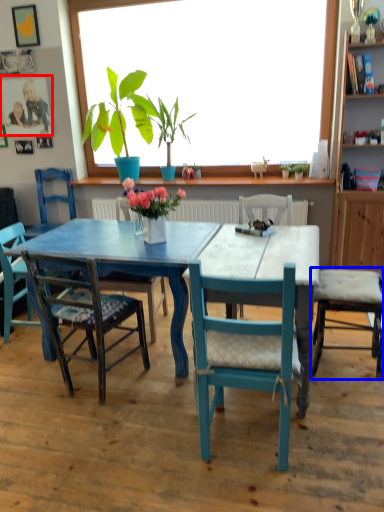
Question: Which of the following is the closest to the observer, picture frame (highlighted by a red box) or chair (highlighted by a blue box)?

Choices:
 (A) picture frame
 (B) chair

Answer: (B)